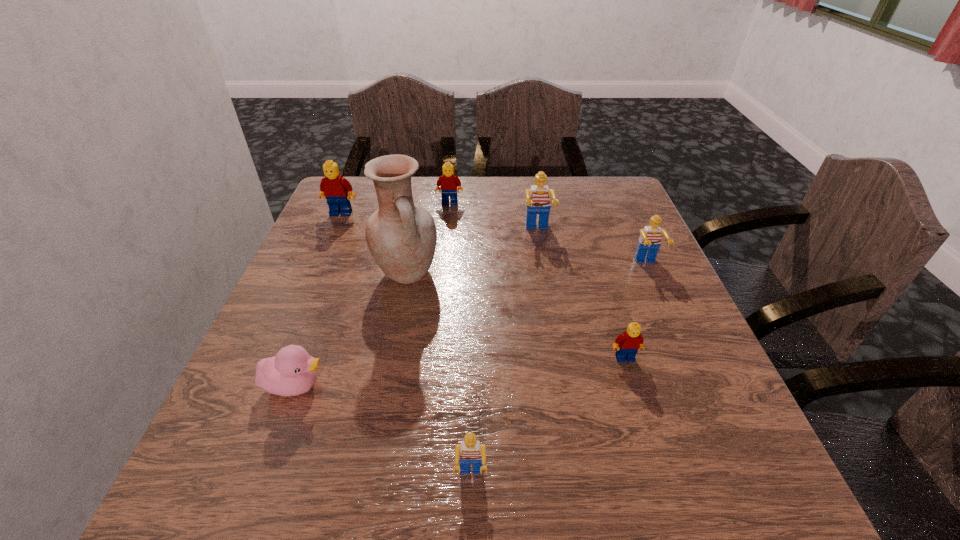
Where is `free space at the far right corner of the desktop`? Image resolution: width=960 pixels, height=540 pixels. free space at the far right corner of the desktop is located at coordinates (598, 186).

In the image, there is a desktop. At what (x,y) coordinates should I click in order to perform the action: click on blank space at the near right corner. Please return your answer as a coordinate pair (x, y). Looking at the image, I should click on (726, 483).

Identify the location of vacant area that lies between the second blue Lego from right to left and the second nearest blue Lego. This screenshot has width=960, height=540. (592, 247).

Where is `vacant space that is in between the smallest blue Lego and the fourth Lego from left to right`? The image size is (960, 540). vacant space that is in between the smallest blue Lego and the fourth Lego from left to right is located at coordinates (504, 354).

The width and height of the screenshot is (960, 540). Identify the location of free space between the leftmost blue Lego and the second yellow Lego from right to left. (461, 340).

Locate an element on the screen. The height and width of the screenshot is (540, 960). vacant area between the seventh farthest object and the nearest object is located at coordinates (384, 431).

In order to click on vacant area that lies between the second nearest Lego and the sixth nearest object in this screenshot , I will do click(x=581, y=294).

Where is `vacant point located between the leftmost blue Lego and the tallest object`? vacant point located between the leftmost blue Lego and the tallest object is located at coordinates (439, 375).

The height and width of the screenshot is (540, 960). What are the coordinates of `blank region between the second blue Lego from right to left and the pottery` in the screenshot? It's located at (472, 252).

I want to click on vacant area between the nearest yellow Lego and the duckling, so click(x=461, y=372).